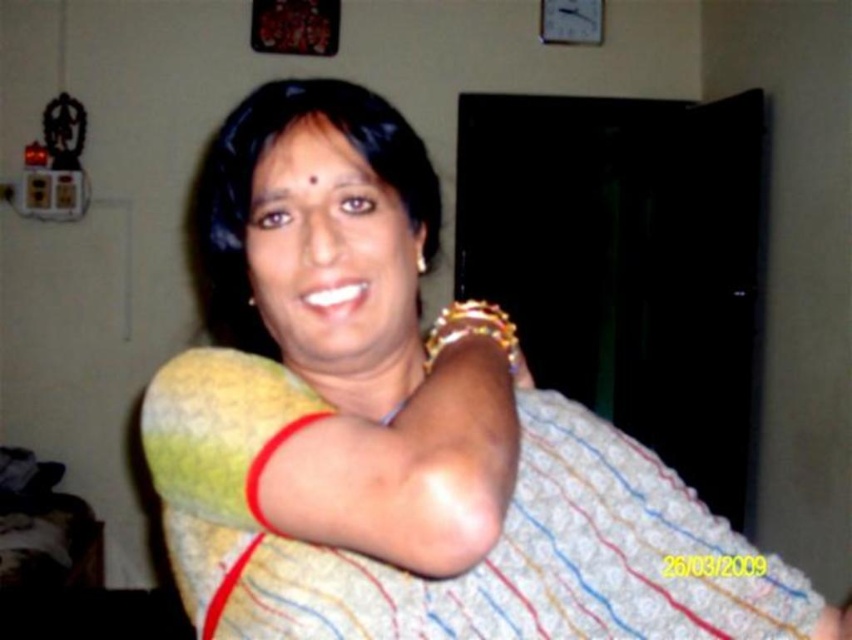
Question: Which point appears closest to the camera in this image?

Choices:
 (A) (309, 236)
 (B) (481, 326)

Answer: (A)

Question: Can you confirm if yellow fabric at center is bigger than gold shiny bracelet at upper right?

Choices:
 (A) no
 (B) yes

Answer: (B)

Question: Is yellow fabric at center to the left of gold shiny bracelet at upper right from the viewer's perspective?

Choices:
 (A) no
 (B) yes

Answer: (B)

Question: Which object is farther from the camera taking this photo?

Choices:
 (A) yellow fabric at center
 (B) gold shiny bracelet at upper right

Answer: (B)

Question: Does yellow fabric at center appear on the right side of gold shiny bracelet at upper right?

Choices:
 (A) yes
 (B) no

Answer: (B)